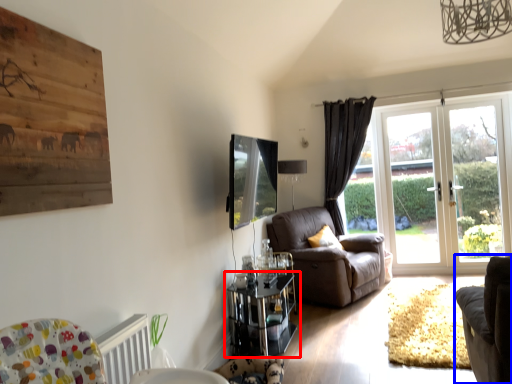
Question: Among these objects, which one is farthest to the camera, table (highlighted by a red box) or chair (highlighted by a blue box)?

Choices:
 (A) table
 (B) chair

Answer: (A)